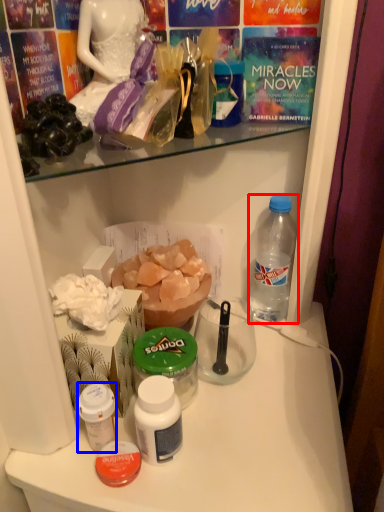
Question: Which object is closer to the camera taking this photo, bottle (highlighted by a red box) or bottle (highlighted by a blue box)?

Choices:
 (A) bottle
 (B) bottle

Answer: (B)